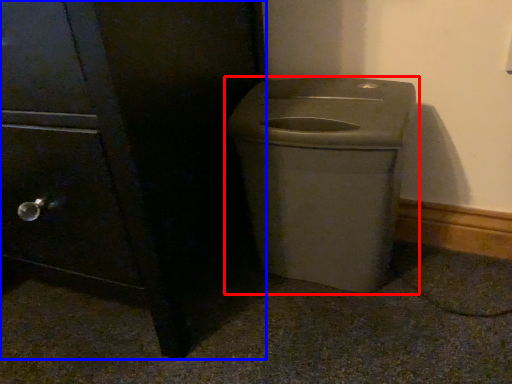
Question: Which point is further to the camera, waste container (highlighted by a red box) or side cabinet (highlighted by a blue box)?

Choices:
 (A) waste container
 (B) side cabinet

Answer: (A)